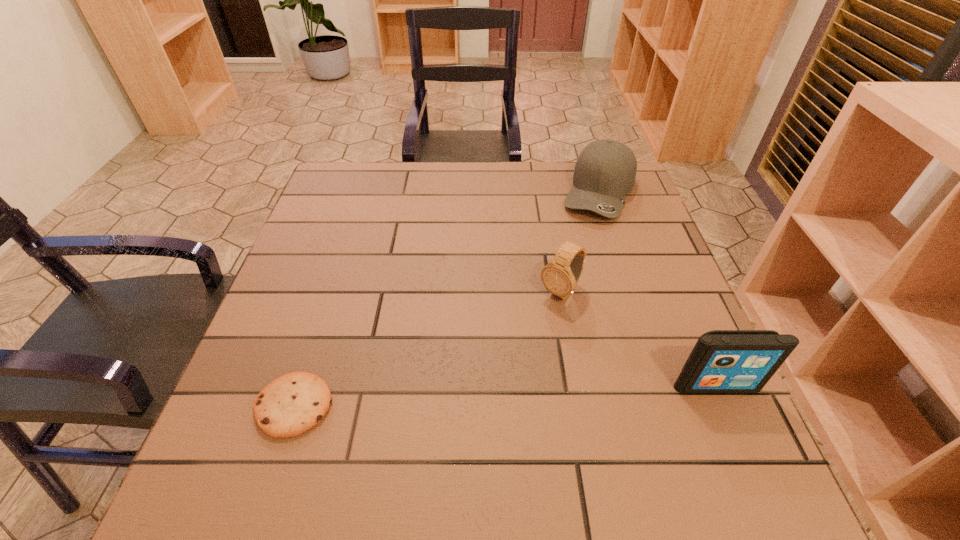
The width and height of the screenshot is (960, 540). Find the location of `free space located on the front brim of the farthest object`. free space located on the front brim of the farthest object is located at coordinates (580, 269).

Where is `vacant area situated 0.360m on the face of the second farthest object`? This screenshot has width=960, height=540. vacant area situated 0.360m on the face of the second farthest object is located at coordinates (434, 432).

Identify the location of free space located on the face of the second farthest object. (426, 441).

You are a GUI agent. You are given a task and a screenshot of the screen. Output one action in this format:
    pyautogui.click(x=<x>, y=<y>)
    Task: Click on the free space located 0.250m on the face of the second farthest object
    Image resolution: width=960 pixels, height=540 pixels.
    Given the screenshot: What is the action you would take?
    pyautogui.click(x=475, y=387)

At what (x,y) coordinates should I click in order to perform the action: click on object present at the far edge. Please return your answer as a coordinate pair (x, y). Looking at the image, I should click on (605, 171).

Where is `object present at the near edge`? object present at the near edge is located at coordinates (292, 404).

Find the location of a particular element. object positioned at the left edge is located at coordinates (292, 404).

Locate an element on the screen. The height and width of the screenshot is (540, 960). iPod that is at the right edge is located at coordinates (722, 361).

This screenshot has height=540, width=960. What are the coordinates of `baseball cap situated at the right edge` in the screenshot? It's located at (605, 171).

The width and height of the screenshot is (960, 540). What are the coordinates of `object at the near left corner` in the screenshot? It's located at (292, 404).